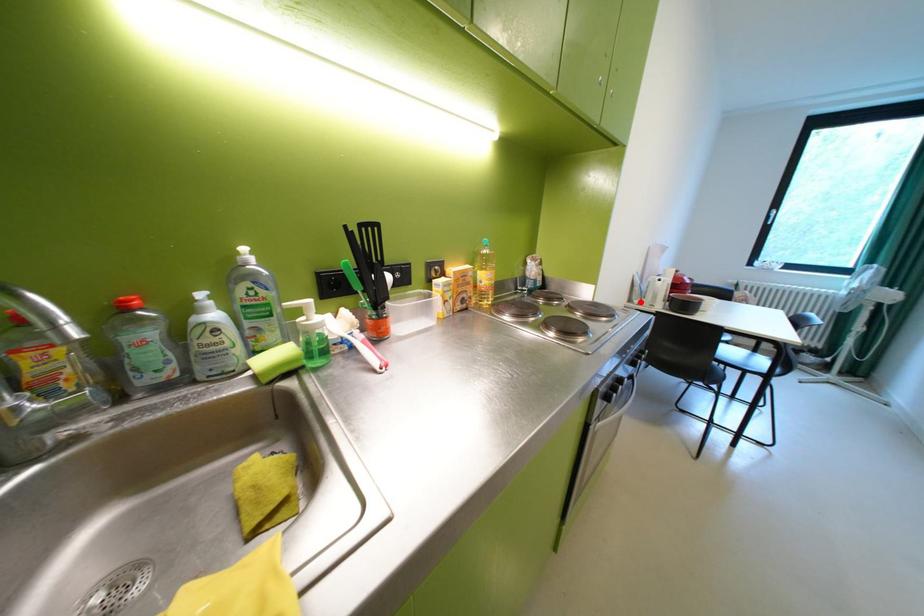
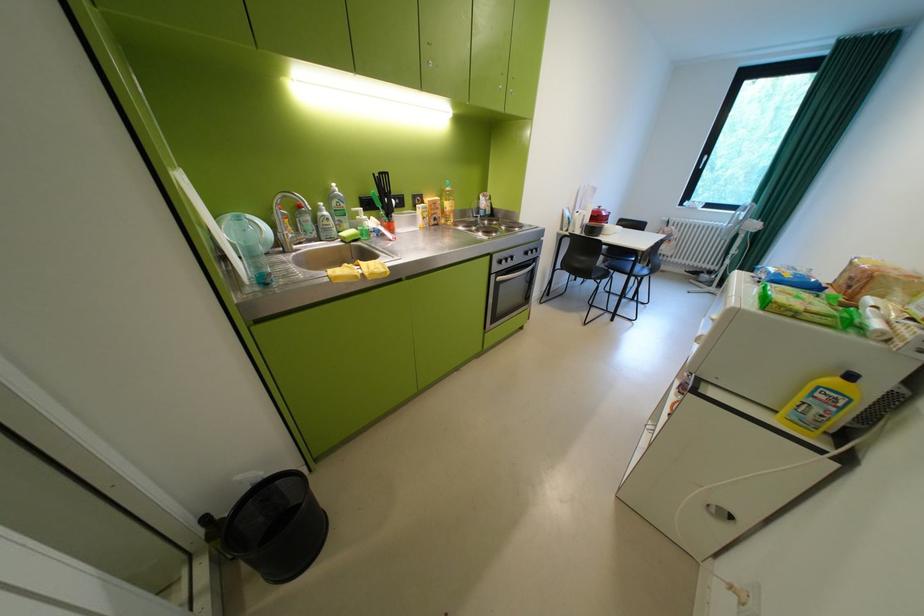
The point at the highlighted location is marked in the first image. Where is the corresponding point in the second image?

(572, 230)